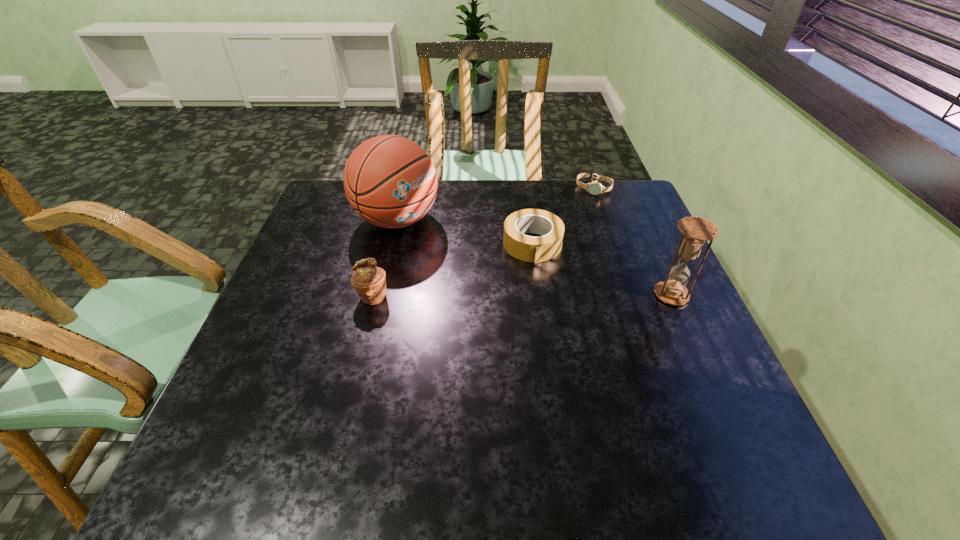
What are the coordinates of `free spot on the desktop that is between the muffin and the hourglass and is positioned on the logo side of the basketball` in the screenshot? It's located at (557, 295).

Locate an element on the screen. The width and height of the screenshot is (960, 540). vacant space on the desktop that is between the muffin and the hourglass and is positioned on the face of the watch is located at coordinates (555, 295).

In order to click on vacant space on the desktop that is between the muffin and the hourglass and is positioned at the edge of the duct tape in this screenshot , I will do [x=543, y=295].